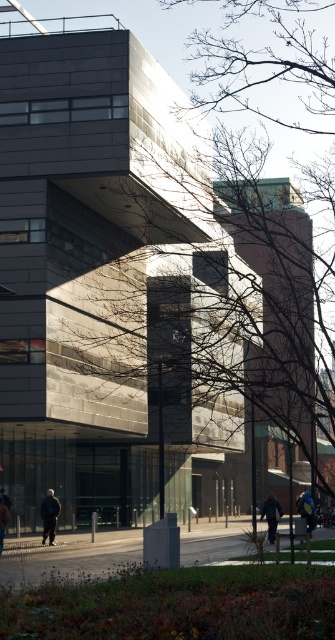
Question: Is dark blue jacket at lower left to the left of blue denim jacket at lower center from the viewer's perspective?

Choices:
 (A) no
 (B) yes

Answer: (B)

Question: Estimate the real-world distances between objects in this image. Which object is farther from the blue denim jacket at lower center?

Choices:
 (A) dark blue jacket at lower center
 (B) dark gray jacket at lower left
 (C) dark blue jacket at lower left

Answer: (B)

Question: Which object is the closest to the dark blue jacket at lower left?

Choices:
 (A) dark blue jacket at lower center
 (B) dark gray jacket at lower left

Answer: (B)

Question: Which point is farther to the camera?

Choices:
 (A) blue denim jacket at lower center
 (B) dark blue jacket at lower center

Answer: (A)

Question: Is dark blue jacket at lower center closer to camera compared to dark gray jacket at lower left?

Choices:
 (A) yes
 (B) no

Answer: (B)

Question: Is dark blue jacket at lower left below blue denim jacket at lower center?

Choices:
 (A) no
 (B) yes

Answer: (A)